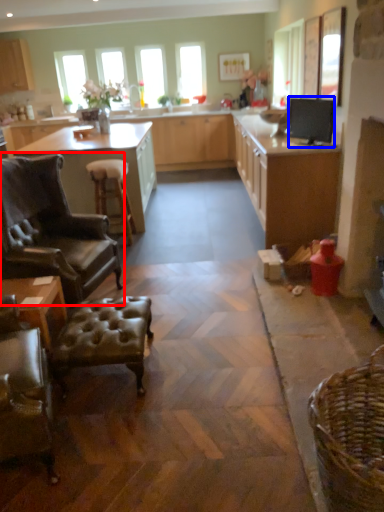
Question: Which object is further to the camera taking this photo, chair (highlighted by a red box) or appliance (highlighted by a blue box)?

Choices:
 (A) chair
 (B) appliance

Answer: (B)